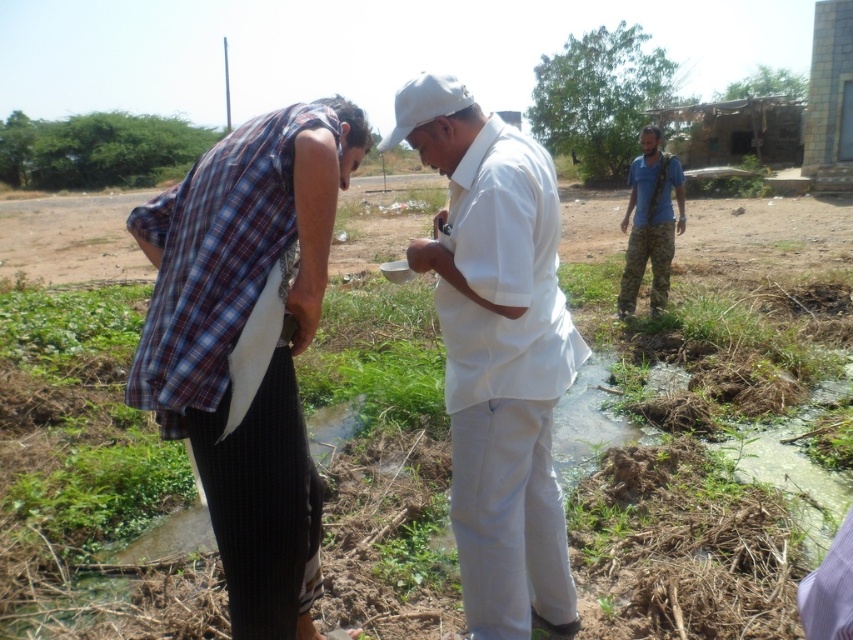
You are a fashion designer observing the two people in the image. You need to determine which clothing item has a greater width between the plaid fabric shirt at left and the camouflage pants at right. Which one is wider?

The plaid fabric shirt at left is wider than the camouflage pants at right.

You are a photographer trying to capture a closeup shot of the plaid fabric shirt at left and the white matte shirt at center. Your camera has a minimum focus distance of 50 centimeters. Can you take the photo without moving either subject?

The distance between the plaid fabric shirt at left and the white matte shirt at center is 52.94 centimeters, which is greater than the camera minimum focus distance of 50 centimeters. Therefore, you can take the photo without moving either subject.

Based on the photo, you are standing in the rural scene and want to place a small flag at the point that is closer to you. Which point should you choose between point (195,416) and point (492,184)?

You should choose point (195,416) because it is closer to the camera than point (492,184).